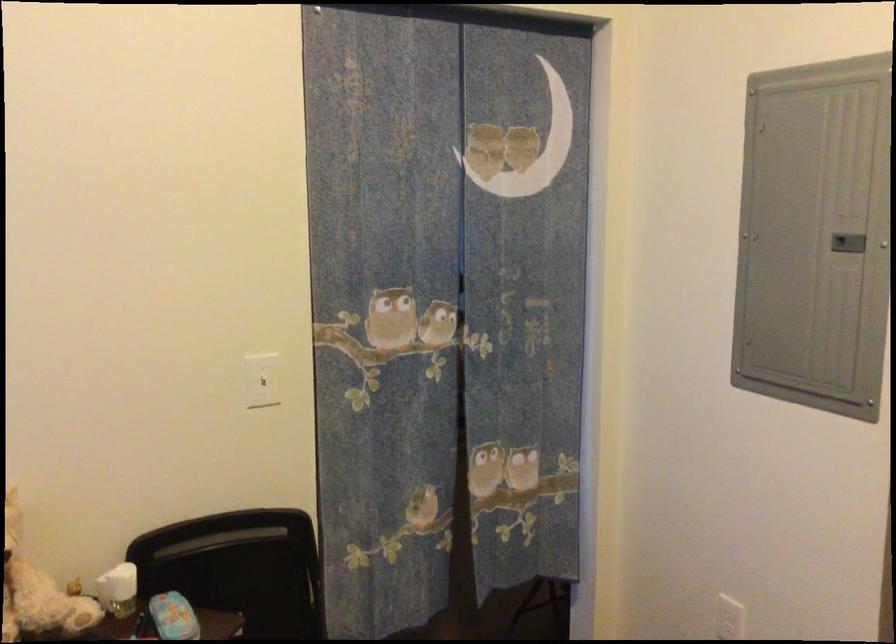
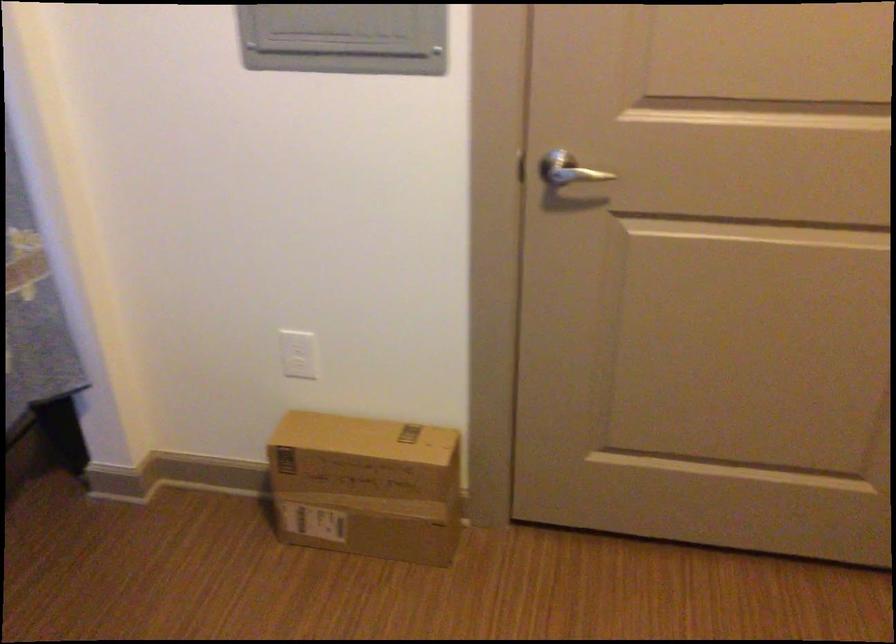
The images are taken continuously from a first-person perspective. In which direction is your viewpoint rotating?

The camera's rotation is toward right-down.